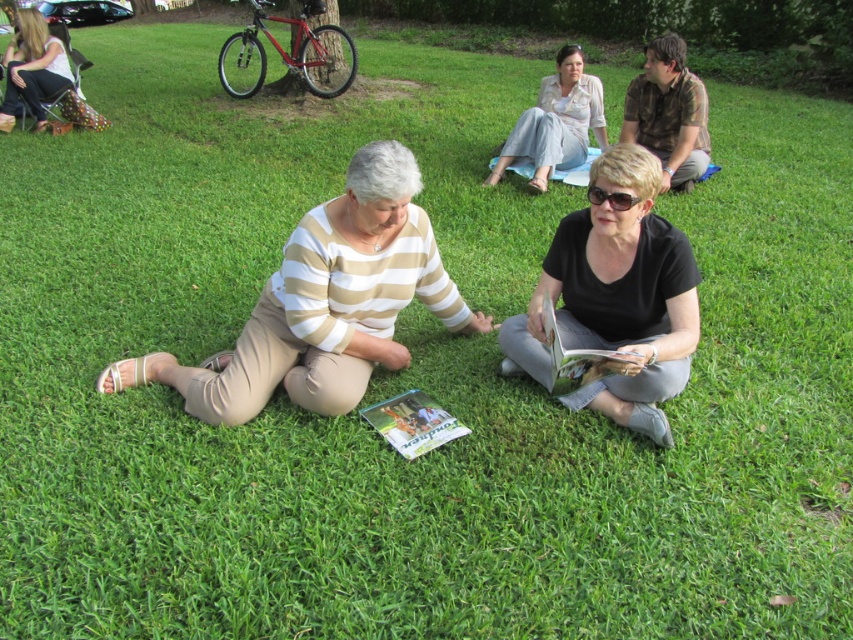
Question: Does light beige cotton blouse at upper center appear over matte black boots at upper left?

Choices:
 (A) no
 (B) yes

Answer: (A)

Question: Based on their relative distances, which object is farther from the matte black boots at upper left?

Choices:
 (A) matte paper book at center
 (B) beige striped shirt at center
 (C) brown camo shirt at upper right

Answer: (A)

Question: Which of the following is the farthest from the observer?

Choices:
 (A) beige striped shirt at center
 (B) brown camo shirt at upper right
 (C) light beige cotton blouse at upper center
 (D) black matte shirt at center

Answer: (C)

Question: Can you confirm if brown camo shirt at upper right is smaller than matte black boots at upper left?

Choices:
 (A) yes
 (B) no

Answer: (A)

Question: Which point appears closest to the camera in this image?

Choices:
 (A) (511, 371)
 (B) (579, 93)
 (C) (563, 348)
 (D) (668, 99)

Answer: (C)

Question: Observing the image, what is the correct spatial positioning of light beige cotton blouse at upper center in reference to matte green magazine at center?

Choices:
 (A) above
 (B) below

Answer: (A)